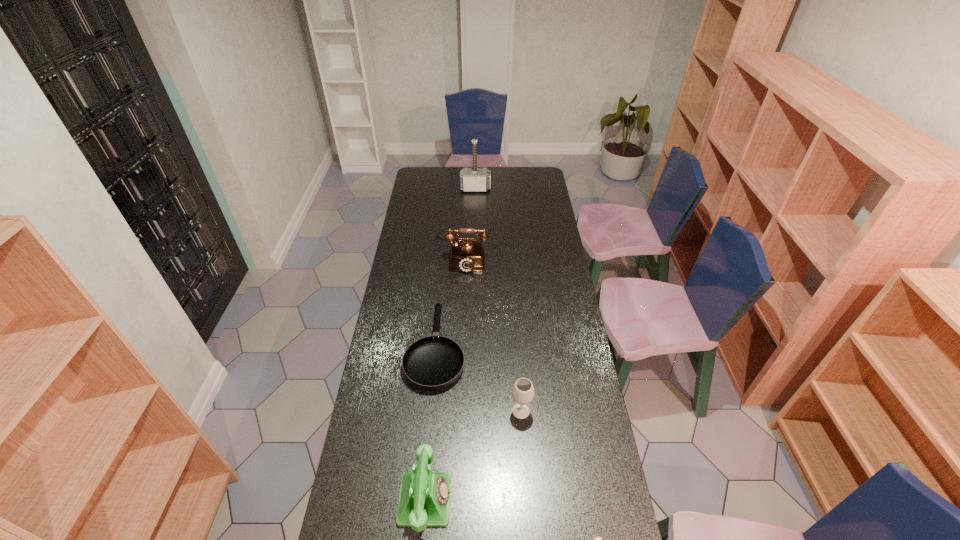
Image resolution: width=960 pixels, height=540 pixels. I want to click on hammer, so click(474, 179).

Find the location of a particular element. This screenshot has width=960, height=540. the tallest object is located at coordinates (474, 179).

Where is `the second farthest object`? This screenshot has height=540, width=960. the second farthest object is located at coordinates click(466, 254).

You are a GUI agent. You are given a task and a screenshot of the screen. Output one action in this format:
    pyautogui.click(x=<x>, y=<y>)
    Task: Click on the farther telephone
    
    Given the screenshot: What is the action you would take?
    coord(466,254)

You are a GUI agent. You are given a task and a screenshot of the screen. Output one action in this format:
    pyautogui.click(x=<x>, y=<y>)
    Task: Click on the fourth farthest object
    Image resolution: width=960 pixels, height=540 pixels.
    Given the screenshot: What is the action you would take?
    pyautogui.click(x=523, y=391)

This screenshot has width=960, height=540. What are the coordinates of `the second object from right to left` in the screenshot? It's located at (523, 391).

At what (x,y) coordinates should I click in order to perform the action: click on frying pan. Please return your answer as a coordinate pair (x, y). Looking at the image, I should click on (434, 362).

Find the location of a particular element. The image size is (960, 540). free space located 0.350m for striking with the head of the farthest object is located at coordinates (475, 230).

At what (x,y) coordinates should I click in order to perform the action: click on free space located on the dial of the farther telephone. Please return your answer as a coordinate pair (x, y). The height and width of the screenshot is (540, 960). Looking at the image, I should click on (460, 327).

Identify the location of vacant space located on the back of the fifth object from left to right. (515, 322).